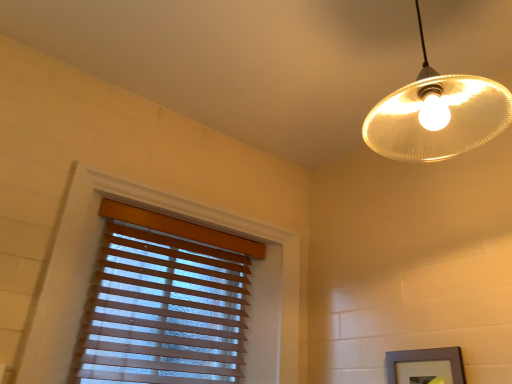
Question: Should I look upward or downward to see wooden blinds at left?

Choices:
 (A) down
 (B) up

Answer: (A)

Question: From the image's perspective, is translucent glass lampshade at upper right beneath gray matte picture frame at lower right?

Choices:
 (A) yes
 (B) no

Answer: (B)

Question: Is translucent glass lampshade at upper right far from gray matte picture frame at lower right?

Choices:
 (A) yes
 (B) no

Answer: (B)

Question: Can we say translucent glass lampshade at upper right lies outside gray matte picture frame at lower right?

Choices:
 (A) yes
 (B) no

Answer: (A)

Question: From the image's perspective, is translucent glass lampshade at upper right located above gray matte picture frame at lower right?

Choices:
 (A) yes
 (B) no

Answer: (A)

Question: Is translucent glass lampshade at upper right positioned in front of gray matte picture frame at lower right?

Choices:
 (A) yes
 (B) no

Answer: (A)

Question: Is gray matte picture frame at lower right surrounded by translucent glass lampshade at upper right?

Choices:
 (A) yes
 (B) no

Answer: (B)

Question: Can you confirm if wooden blinds at left is smaller than gray matte picture frame at lower right?

Choices:
 (A) yes
 (B) no

Answer: (B)

Question: Is wooden blinds at left at the right side of gray matte picture frame at lower right?

Choices:
 (A) no
 (B) yes

Answer: (A)

Question: Can you confirm if wooden blinds at left is shorter than gray matte picture frame at lower right?

Choices:
 (A) no
 (B) yes

Answer: (A)

Question: Is wooden blinds at left positioned behind gray matte picture frame at lower right?

Choices:
 (A) no
 (B) yes

Answer: (B)

Question: Could you tell me if wooden blinds at left is turned towards gray matte picture frame at lower right?

Choices:
 (A) no
 (B) yes

Answer: (B)

Question: Considering the relative sizes of wooden blinds at left and gray matte picture frame at lower right in the image provided, is wooden blinds at left bigger than gray matte picture frame at lower right?

Choices:
 (A) yes
 (B) no

Answer: (A)

Question: Is gray matte picture frame at lower right bigger than translucent glass lampshade at upper right?

Choices:
 (A) yes
 (B) no

Answer: (B)